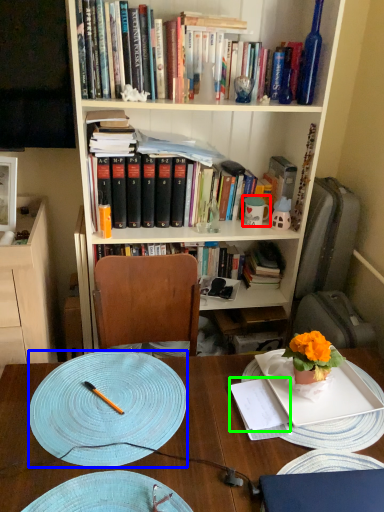
Question: Which is farther away from tableware (highlighted by a red box)? plate (highlighted by a blue box) or notebook (highlighted by a green box)?

Choices:
 (A) plate
 (B) notebook

Answer: (A)